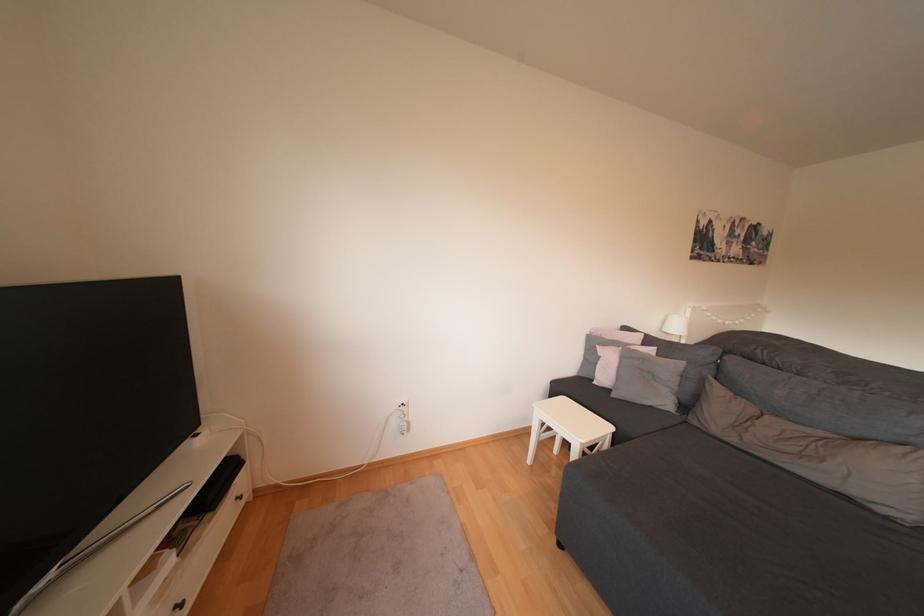
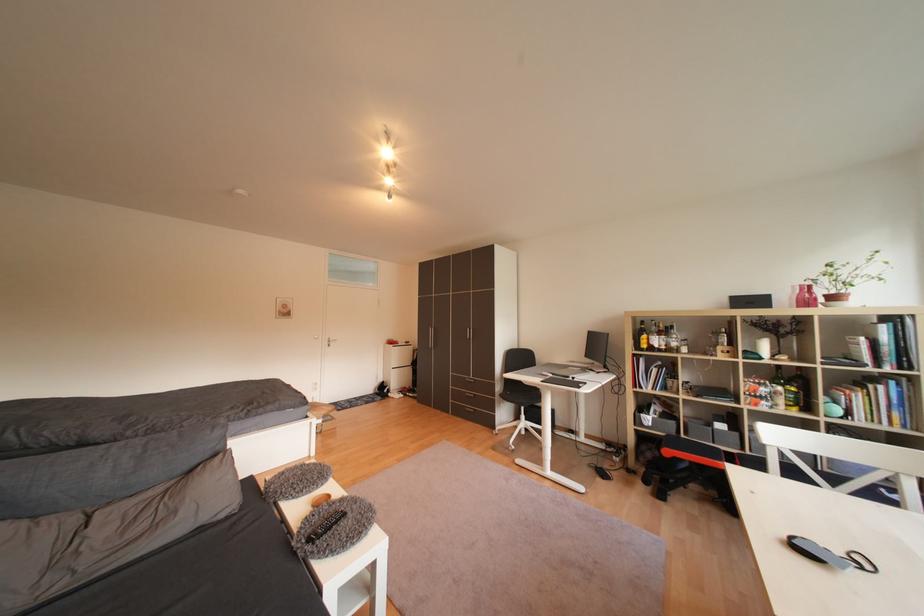
Question: The images are taken continuously from a first-person perspective. In which direction is your viewpoint rotating?

Choices:
 (A) Left
 (B) Right
 (C) Up
 (D) Down

Answer: (B)